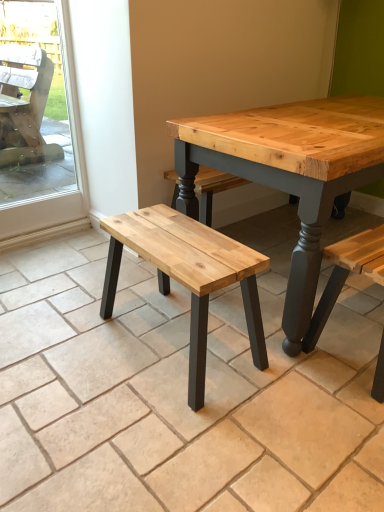
The image size is (384, 512). I want to click on free space above natural wood bench at center (from a real-world perspective), so click(186, 317).